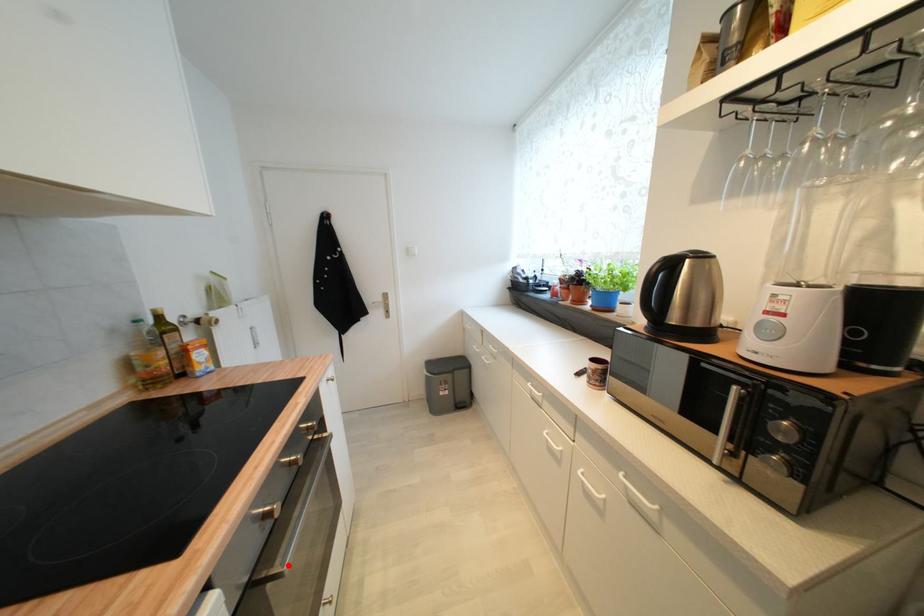
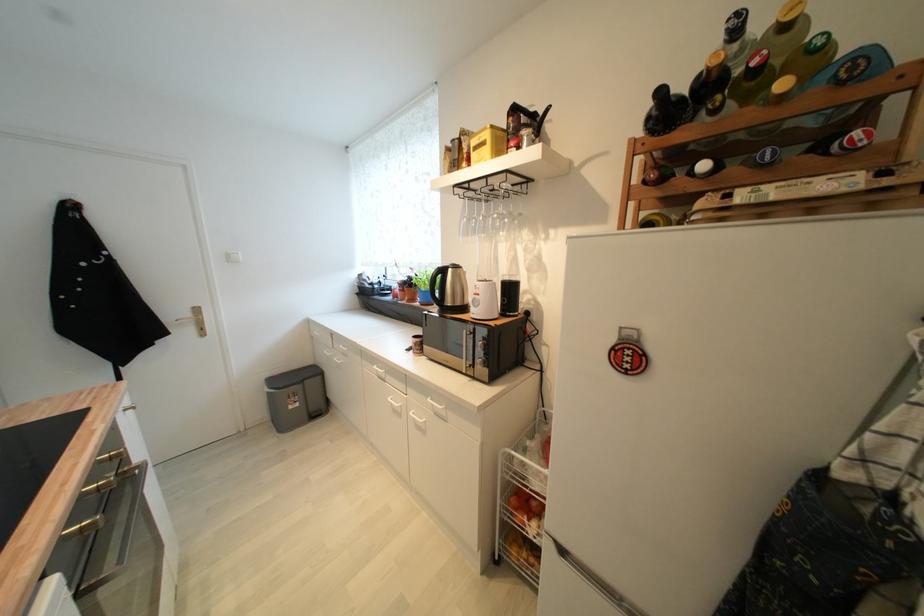
Find the pixel in the second image that matches the highlighted location in the first image.

(126, 564)